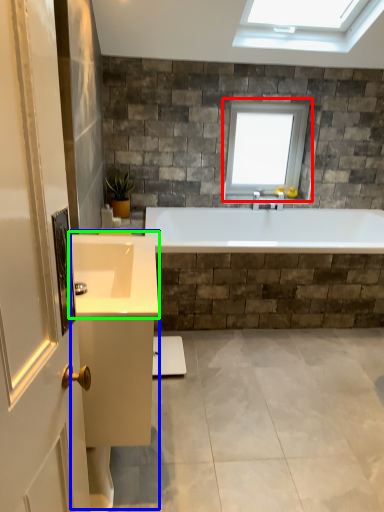
Question: Which object is positioned closest to window (highlighted by a red box)? Select from vanity (highlighted by a blue box) and sink (highlighted by a green box).

Choices:
 (A) vanity
 (B) sink

Answer: (B)